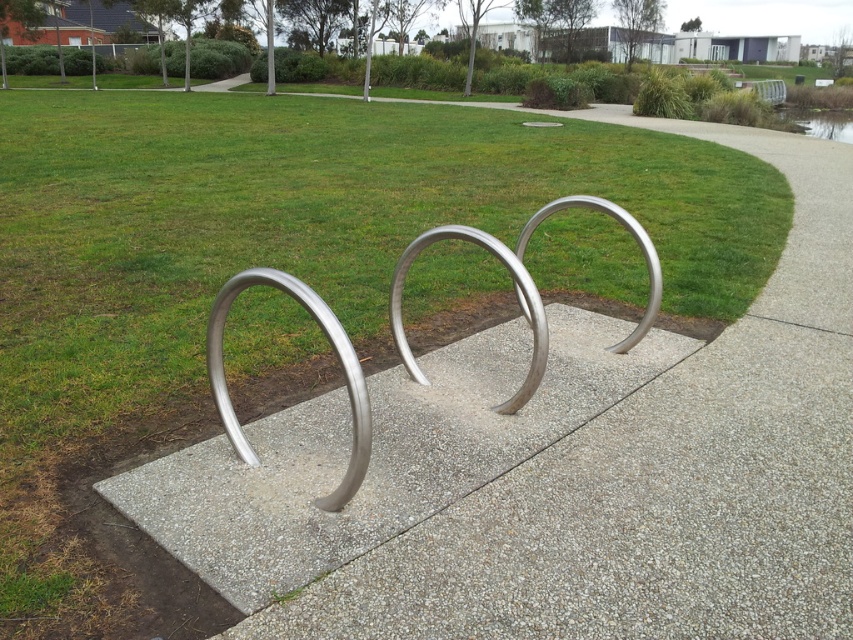
Consider the image. You are standing at the camera position and want to reach point (143, 480). If your walking speed is 3 feet per second, how many seconds will it take you to reach that point?

The distance of point (143, 480) from camera is 8.14 feet. At a speed of 3 feet per second, it will take 8.14 divided by 3, which is approximately 2.71 seconds to reach the point.

From the picture: You are a maintenance worker checking the bicycle rack. You need to know if the sanded concrete at center is higher than the polished metal bike rack at center. Can you confirm this?

Yes, the sanded concrete at center has a greater height compared to the polished metal bike rack at center, so it is higher.

You are a delivery person trying to park a bike that is 1.2 meters wide. The bike needs to be placed on the sanded concrete at center or the polished metal bike rack at center. Which location can accommodate the bike based on their widths?

The sanded concrete at center has a greater width than the polished metal bike rack at center. Therefore, the sanded concrete at center can accommodate the 1.2 meters wide bike, while the polished metal bike rack at center may not have sufficient width.